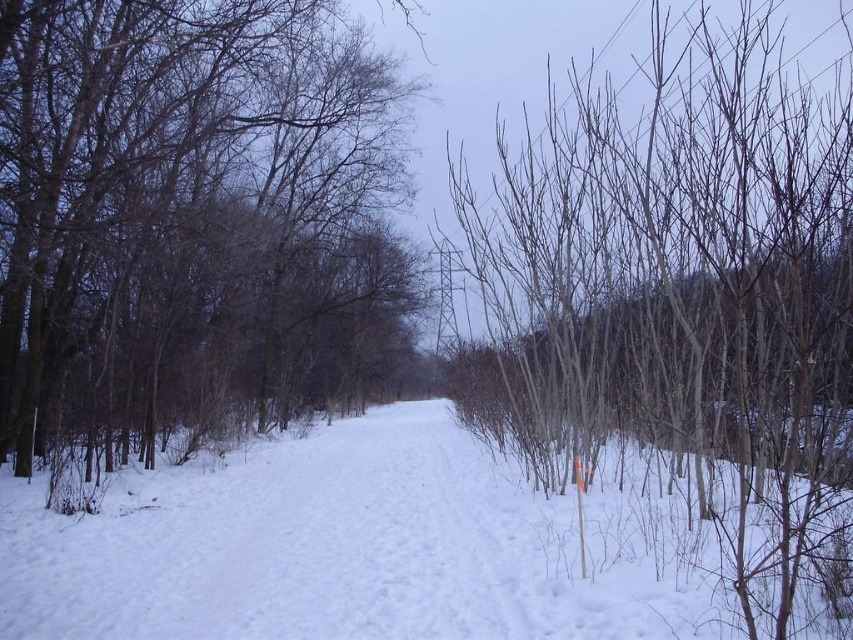
Based on the photo, you are standing at the point marked as point (194, 225) in the winter scene. What type of tree is directly beneath your feet?

The smooth bark tree at center is located at point (194, 225), so the tree directly beneath your feet is the smooth bark tree at center.

You are standing at the edge of the snow path and want to walk towards the center. Which object will you encounter first, the smooth bark tree at center or the white powdery snow at center?

The white powdery snow at center is encountered first because it is wider than the smooth bark tree at center, so the snow covers more of the path and you step on it before reaching the tree.

You are an observer standing on the path in the winter scene. You notice the smooth bark trees at right and the white powdery snow at center. Which object is closer to you?

The smooth bark trees at right are closer to you because they are in front of the white powdery snow at center.